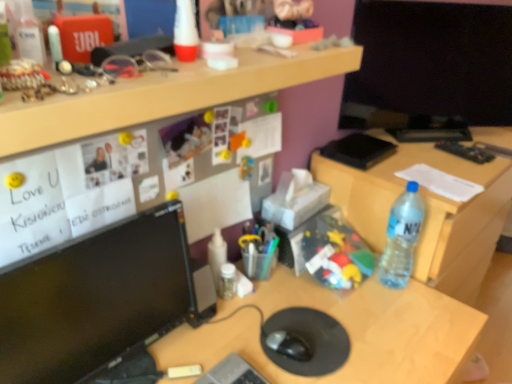
Image resolution: width=512 pixels, height=384 pixels. What do you see at coordinates (162, 95) in the screenshot?
I see `wooden desk at upper center, arranged as the 1th desk when viewed from the top` at bounding box center [162, 95].

This screenshot has height=384, width=512. Describe the element at coordinates (345, 329) in the screenshot. I see `matte black monitor at center, acting as the 1th desk starting from the bottom` at that location.

What is the approximate height of black rubber mousepad at center?

black rubber mousepad at center is 0.57 inches tall.

What do you see at coordinates (401, 238) in the screenshot? Image resolution: width=512 pixels, height=384 pixels. I see `translucent plastic bottle at right, marked as the second bottle in a left-to-right arrangement` at bounding box center [401, 238].

Where is `translucent plastic bottle at right, marked as the second bottle in a left-to-right arrangement`? The height and width of the screenshot is (384, 512). translucent plastic bottle at right, marked as the second bottle in a left-to-right arrangement is located at coordinates (401, 238).

Locate an element on the screen. black glossy monitor at upper right is located at coordinates (432, 61).

What do you see at coordinates (432, 61) in the screenshot? I see `black glossy monitor at upper right` at bounding box center [432, 61].

Find the location of a particular element. wooden desk at upper center, arranged as the 1th desk when viewed from the top is located at coordinates (162, 95).

Is white paperboard at upper left not close to clear plastic bottle at right, which ranks as the second desk in bottom-to-top order?

Actually, white paperboard at upper left and clear plastic bottle at right, which ranks as the second desk in bottom-to-top order, are a little close together.

At what (x,y) coordinates should I click in order to perform the action: click on the 3rd desk counting from the right of the white paperboard at upper left. Please return your answer as a coordinate pair (x, y). Looking at the image, I should click on (426, 212).

Is white paperboard at upper left positioned beyond the bounds of clear plastic bottle at right, which ranks as the second desk in bottom-to-top order?

Indeed, white paperboard at upper left is completely outside clear plastic bottle at right, which ranks as the second desk in bottom-to-top order.

Measure the distance from white paperboard at upper left to clear plastic bottle at right, which ranks as the second desk in bottom-to-top order.

23.32 inches.

How many degrees apart are the facing directions of white paperboard at upper left and black matte mouse at center?

The angular difference between white paperboard at upper left and black matte mouse at center is 17.9 degrees.

Is white paperboard at upper left taller or shorter than black matte mouse at center?

white paperboard at upper left is taller than black matte mouse at center.

Looking at their sizes, would you say white paperboard at upper left is wider or thinner than black matte mouse at center?

white paperboard at upper left is thinner than black matte mouse at center.

Is white paperboard at upper left outside of black matte mouse at center?

Absolutely, white paperboard at upper left is external to black matte mouse at center.

From the image's perspective, is translucent plastic toy at center, which is counted as the second toy, starting from the top, on top of translucent plastic bottle at right, marked as the second bottle in a left-to-right arrangement?

Yes, from the image's perspective, translucent plastic toy at center, which is counted as the second toy, starting from the top, is above translucent plastic bottle at right, marked as the second bottle in a left-to-right arrangement.

Is point (248, 172) more distant than point (398, 275)?

No, it is in front of (398, 275).

Which object is further away from the camera taking this photo, translucent plastic toy at center, which is counted as the second toy, starting from the top, or translucent plastic bottle at right, which appears as the 1th bottle when viewed from the right?

translucent plastic toy at center, which is counted as the second toy, starting from the top, is further from the camera.

How much distance is there between translucent plastic toy at center, placed as the first toy when sorted from bottom to top, and translucent plastic bottle at right, which appears as the 1th bottle when viewed from the right?

translucent plastic toy at center, placed as the first toy when sorted from bottom to top, is 19.11 inches from translucent plastic bottle at right, which appears as the 1th bottle when viewed from the right.

From the image's perspective, between white paperboard at upper left and wooden desk at upper center, arranged as the 1th desk when viewed from the top, who is located below?

white paperboard at upper left.

This screenshot has height=384, width=512. I want to click on desk located above the white paperboard at upper left (from the image's perspective), so click(x=162, y=95).

Looking at this image, is white paperboard at upper left located outside wooden desk at upper center, the 3th desk ordered from the bottom?

Yes, white paperboard at upper left is outside of wooden desk at upper center, the 3th desk ordered from the bottom.

Looking at this image, how different are the orientations of gray plastic laptop keyboard at center and black glossy monitor at upper right in degrees?

The angle between the facing direction of gray plastic laptop keyboard at center and the facing direction of black glossy monitor at upper right is 39.6 degrees.

Is gray plastic laptop keyboard at center far away from black glossy monitor at upper right?

gray plastic laptop keyboard at center is far away from black glossy monitor at upper right.

Which object is thinner, gray plastic laptop keyboard at center or black glossy monitor at upper right?

With smaller width is black glossy monitor at upper right.

In terms of size, does gray plastic laptop keyboard at center appear bigger or smaller than black glossy monitor at upper right?

Clearly, gray plastic laptop keyboard at center is smaller in size than black glossy monitor at upper right.

Does black glossy monitor at left have a larger size compared to black rubber mousepad at center?

Indeed, black glossy monitor at left has a larger size compared to black rubber mousepad at center.

Between black glossy monitor at left and black rubber mousepad at center, which one has more height?

black glossy monitor at left.

Is point (157, 328) less distant than point (327, 366)?

Yes, point (157, 328) is closer to viewer.

Consider the image. From a real-world perspective, is black glossy monitor at left positioned over black rubber mousepad at center based on gravity?

Yes.

Do you think black glossy monitor at upper right is within white paperboard at upper left, or outside of it?

black glossy monitor at upper right is not inside white paperboard at upper left, it's outside.

Considering the relative positions of black glossy monitor at upper right and white paperboard at upper left in the image provided, is black glossy monitor at upper right to the left or to the right of white paperboard at upper left?

Clearly, black glossy monitor at upper right is on the right of white paperboard at upper left in the image.

Which point is more forward, [410,51] or [168,156]?

Positioned in front is point [168,156].

This screenshot has height=384, width=512. I want to click on the 1st desk below the white paperboard at upper left (from a real-world perspective), so click(x=426, y=212).

Find the location of a particular element. The width and height of the screenshot is (512, 384). bulletin board that is in front of the black matte mouse at center is located at coordinates (141, 179).

Looking at this image, when comparing their distances from white paperboard at upper left, does translucent plastic toy at center, placed as the first toy when sorted from bottom to top, or black glossy monitor at upper right seem closer?

Based on the image, translucent plastic toy at center, placed as the first toy when sorted from bottom to top, appears to be nearer to white paperboard at upper left.

From the image, which object appears to be nearer to black glossy monitor at left, black matte notepad at upper right or translucent plastic bottle at center, which is the 2th bottle from right to left?

translucent plastic bottle at center, which is the 2th bottle from right to left, lies closer to black glossy monitor at left than the other object.

Looking at this image, from the image, which object appears to be farther from translucent plastic toy at center, which is counted as the second toy, starting from the top, clear plastic bottle at right, which ranks as the second desk in bottom-to-top order, or black glossy monitor at left?

Among the two, clear plastic bottle at right, which ranks as the second desk in bottom-to-top order, is located further to translucent plastic toy at center, which is counted as the second toy, starting from the top.

From the image, which object appears to be nearer to translucent plastic bottle at center, which is the 2th bottle from right to left, black matte mouse at center or black glossy monitor at left?

black matte mouse at center.

When comparing their distances from gray plastic laptop keyboard at center, does black matte mouse at center or wooden desk at upper center, arranged as the 1th desk when viewed from the top, seem further?

wooden desk at upper center, arranged as the 1th desk when viewed from the top, lies further to gray plastic laptop keyboard at center than the other object.

Estimate the real-world distances between objects in this image. Which object is further from transparent plastic remote control at right, black matte notepad at upper right or plastic toy at center, marked as the first toy in a front-to-back arrangement?

Based on the image, plastic toy at center, marked as the first toy in a front-to-back arrangement, appears to be further to transparent plastic remote control at right.

From the image, which object appears to be farther from translucent plastic bottle at right, marked as the second bottle in a left-to-right arrangement, black matte mouse at center or plastic toy at center, which is the second toy in bottom-to-top order?

plastic toy at center, which is the second toy in bottom-to-top order, lies further to translucent plastic bottle at right, marked as the second bottle in a left-to-right arrangement, than the other object.

Which object lies nearer to the anchor point black matte notepad at upper right, translucent plastic bottle at right, marked as the second bottle in a left-to-right arrangement, or white paperboard at upper left?

The object closer to black matte notepad at upper right is translucent plastic bottle at right, marked as the second bottle in a left-to-right arrangement.

This screenshot has height=384, width=512. Identify the location of laptop keyboard between black glossy monitor at upper right and matte black monitor at center, acting as the 1th desk starting from the bottom, in the up-down direction. coord(232,372).

Locate an element on the screen. The image size is (512, 384). bulletin board between black glossy monitor at left and clear plastic bottle at right, which ranks as the second desk in bottom-to-top order, from left to right is located at coordinates (141, 179).

Identify the location of mousepad located between gray plastic laptop keyboard at center and black matte notepad at upper right in the depth direction. (310, 340).

The image size is (512, 384). What are the coordinates of `mouse between black glossy monitor at left and translucent plastic bottle at center, which is the 2th bottle from right to left, from front to back` in the screenshot? It's located at (288, 345).